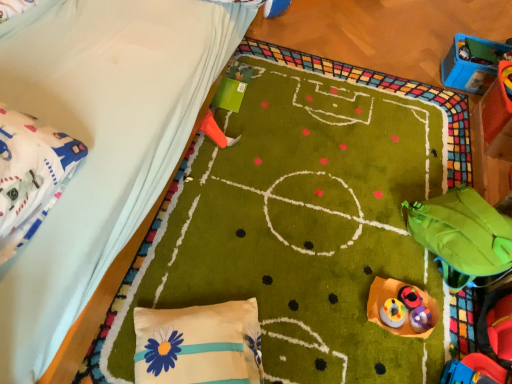
Where is `vacant space situated on the left part of rubberized yellow toy at center, the 5th toy in the back-to-front sequence`? Image resolution: width=512 pixels, height=384 pixels. vacant space situated on the left part of rubberized yellow toy at center, the 5th toy in the back-to-front sequence is located at coordinates (366, 310).